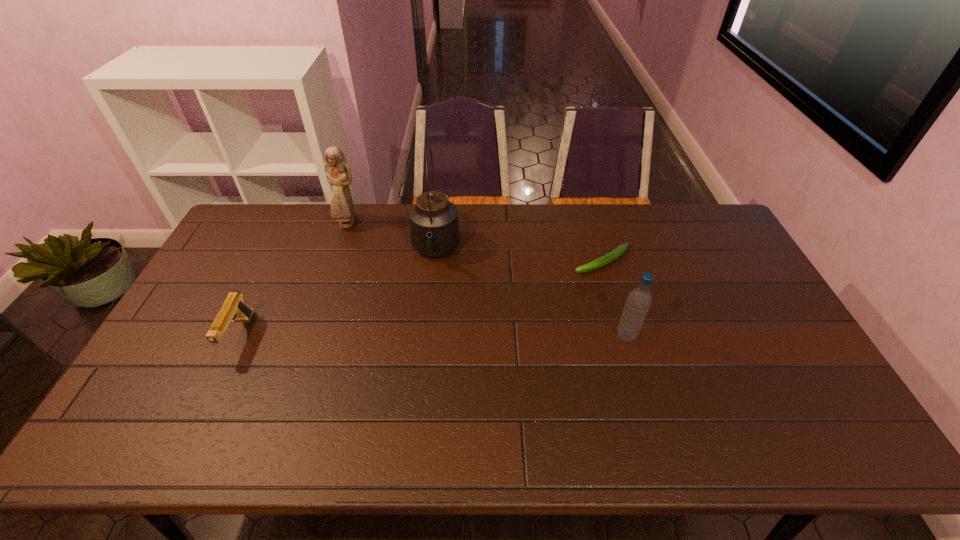
The image size is (960, 540). Identify the location of the fourth tallest object. (233, 308).

Locate an element on the screen. The image size is (960, 540). the leftmost object is located at coordinates point(233,308).

Image resolution: width=960 pixels, height=540 pixels. Identify the location of the third tallest object. (639, 300).

Where is `zucchini`? The image size is (960, 540). zucchini is located at coordinates pos(620,250).

This screenshot has height=540, width=960. What are the coordinates of `kettle` in the screenshot? It's located at (434, 228).

Locate an element on the screen. This screenshot has height=540, width=960. the tallest object is located at coordinates (434, 228).

You are a GUI agent. You are given a task and a screenshot of the screen. Output one action in this format:
    pyautogui.click(x=<x>, y=<y>)
    Task: Click on the second tallest object
    This screenshot has width=960, height=540.
    Given the screenshot: What is the action you would take?
    pyautogui.click(x=337, y=170)

The image size is (960, 540). In order to click on the fourth object from right to left in this screenshot , I will do (337, 170).

The image size is (960, 540). Find the location of `free space located 0.120m at the barrel of the pistol`. free space located 0.120m at the barrel of the pistol is located at coordinates (207, 403).

Where is `free space located 0.110m on the left of the water bottle`? free space located 0.110m on the left of the water bottle is located at coordinates (577, 336).